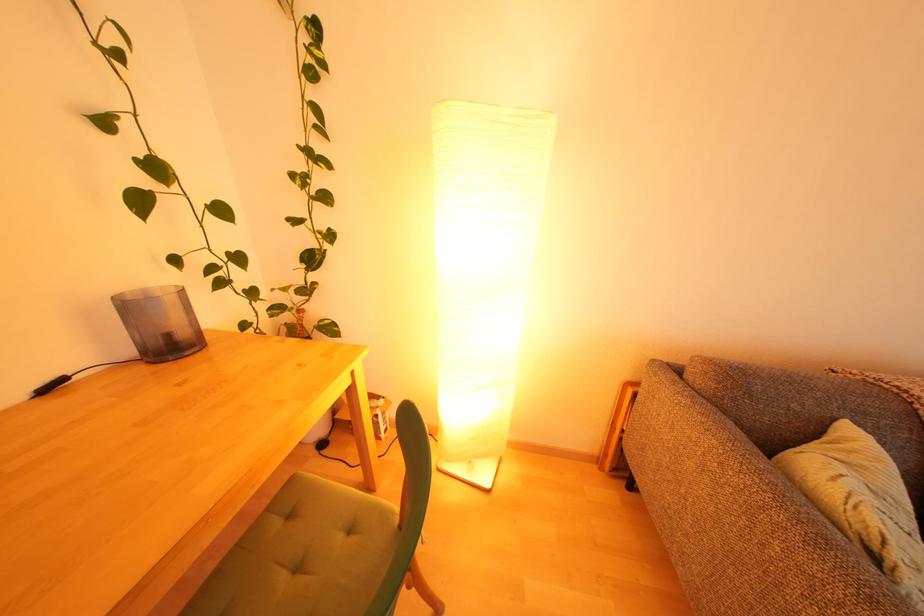
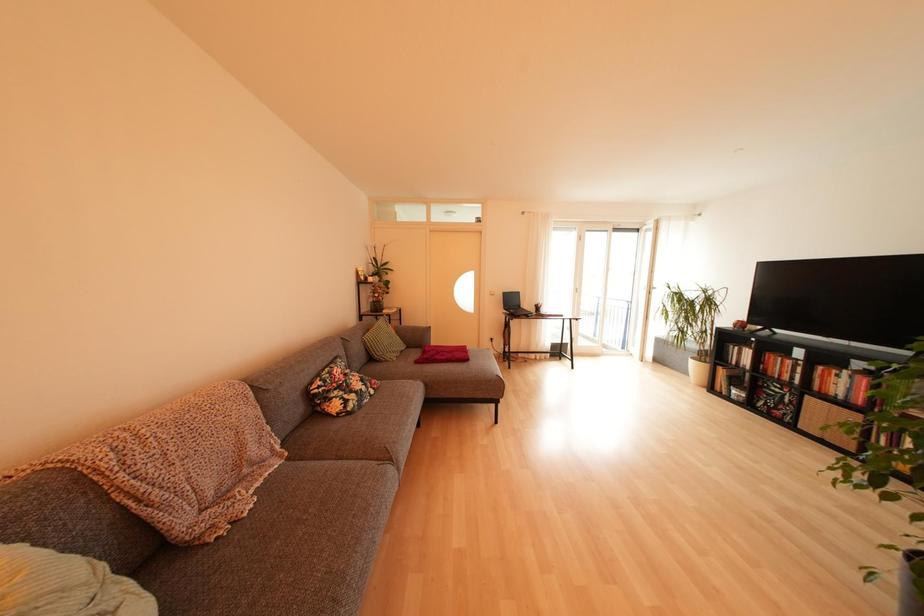
Question: The images are taken continuously from a first-person perspective. In which direction is your viewpoint rotating?

Choices:
 (A) Left
 (B) Right
 (C) Up
 (D) Down

Answer: (B)